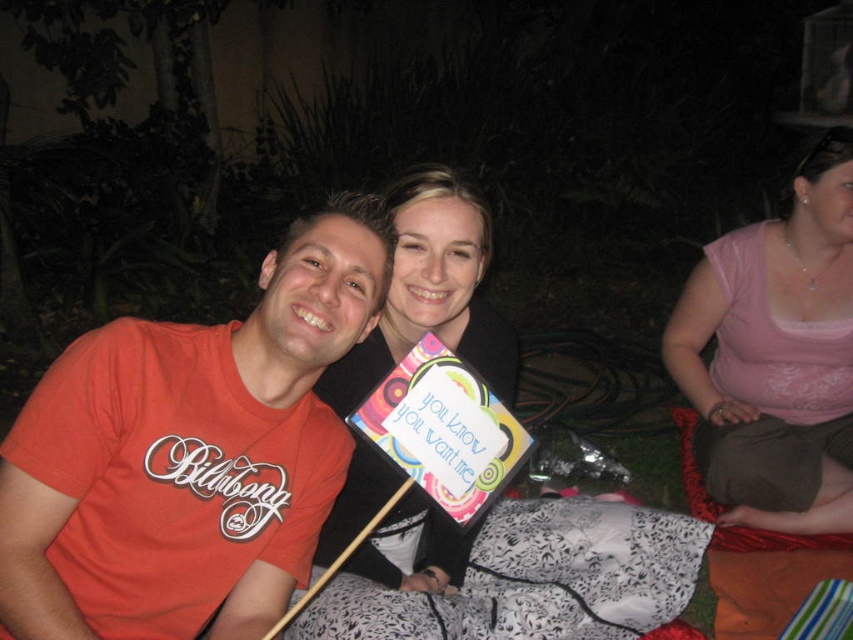
You are at a nighttime gathering and want to sit on the fabric that is higher. Which one should you choose between the pink fabric at right and the black printed fabric blanket at center?

The pink fabric at right has a greater height compared to the black printed fabric blanket at center, so you should choose the pink fabric at right.